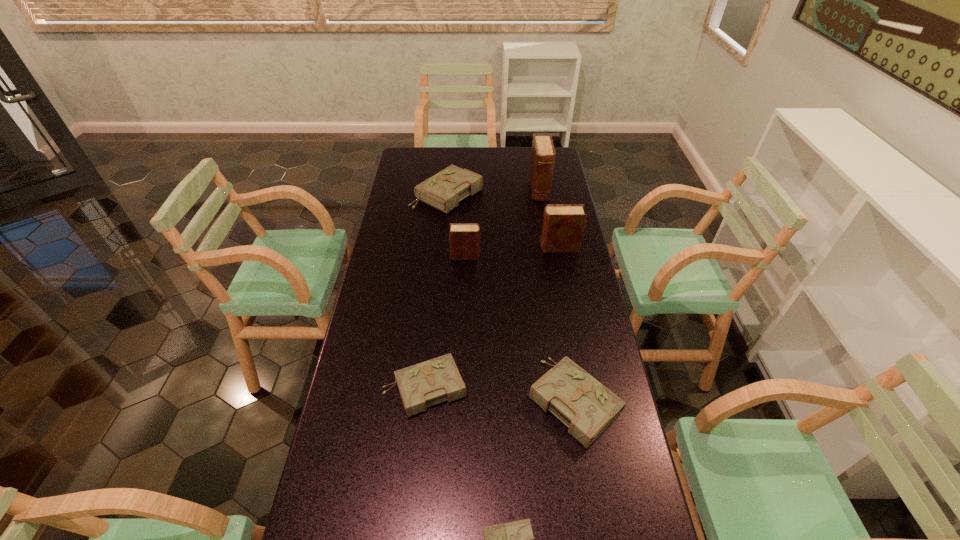
Where is `free space at the right edge of the desktop`? free space at the right edge of the desktop is located at coordinates (589, 295).

The width and height of the screenshot is (960, 540). I want to click on vacant space at the far left corner, so click(x=417, y=172).

Where is `vacant region at the far right corner`? This screenshot has width=960, height=540. vacant region at the far right corner is located at coordinates (528, 161).

The height and width of the screenshot is (540, 960). Identify the location of vacant area between the fifth shortest object and the second shortest object. (445, 322).

The height and width of the screenshot is (540, 960). I want to click on free space between the sixth shortest diary and the leftmost brown diary, so click(x=513, y=252).

Where is `vacant space that is in between the tallest diary and the farthest green diary`? The image size is (960, 540). vacant space that is in between the tallest diary and the farthest green diary is located at coordinates 493,192.

Where is `blank region between the farthest green diary and the fifth tallest diary`? The width and height of the screenshot is (960, 540). blank region between the farthest green diary and the fifth tallest diary is located at coordinates (511, 297).

Identify the location of free spot between the third tallest diary and the tallest diary. (502, 223).

Choose which object is the second nearest neighbor to the leftmost brown diary. Please provide its 2D coordinates. Your answer should be formatted as a tuple, i.e. [(x, y)], where the tuple contains the x and y coordinates of a point satisfying the conditions above.

[(443, 191)]

The height and width of the screenshot is (540, 960). What are the coordinates of `object identified as the second closest to the third shortest object` in the screenshot? It's located at (422, 385).